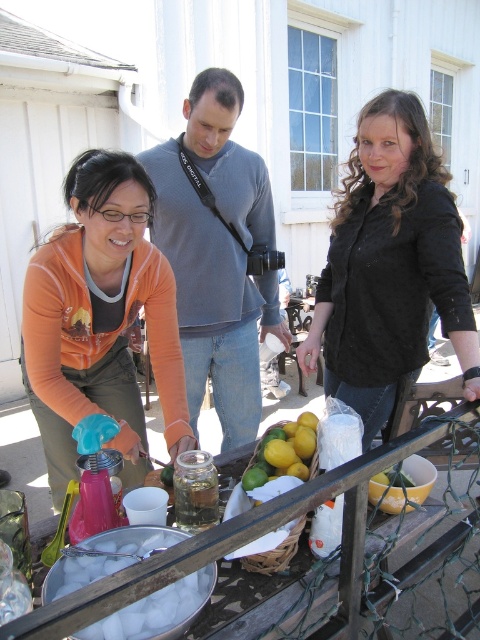
Question: Does orange fabric apron at lower left appear on the left side of black textured shirt at center?

Choices:
 (A) yes
 (B) no

Answer: (A)

Question: Can you confirm if black textured shirt at center is positioned above gray cotton sweater at center?

Choices:
 (A) yes
 (B) no

Answer: (B)

Question: Is gray cotton sweater at center behind yellow matte lemons at center?

Choices:
 (A) no
 (B) yes

Answer: (B)

Question: Which point is closer to the camera taking this photo?

Choices:
 (A) (347, 204)
 (B) (29, 364)
 (C) (120, 637)
 (D) (164, 152)

Answer: (C)

Question: Among these objects, which one is nearest to the camera?

Choices:
 (A) black textured shirt at center
 (B) orange fabric apron at lower left

Answer: (A)

Question: Which point is closer to the camera taking this photo?

Choices:
 (A) (108, 637)
 (B) (272, 458)
 (C) (179, 236)
 (D) (45, 433)

Answer: (A)